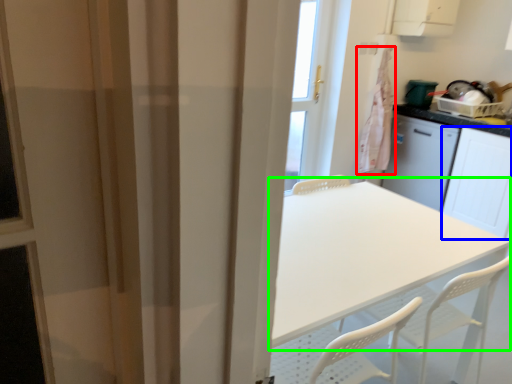
Question: Which is farther away from laundry (highlighted by a red box)? screen door (highlighted by a blue box) or table (highlighted by a green box)?

Choices:
 (A) screen door
 (B) table

Answer: (B)